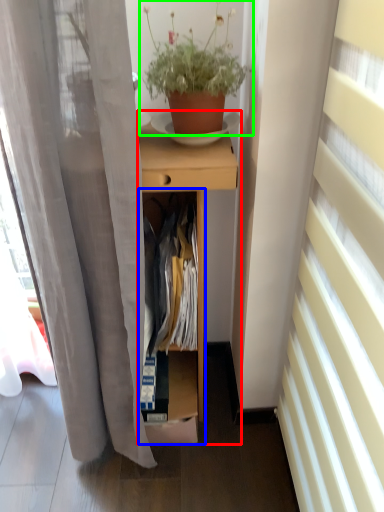
Question: Which is nearer to the desk (highlighted by a red box)? cabinet (highlighted by a blue box) or houseplant (highlighted by a green box).

Choices:
 (A) cabinet
 (B) houseplant

Answer: (A)